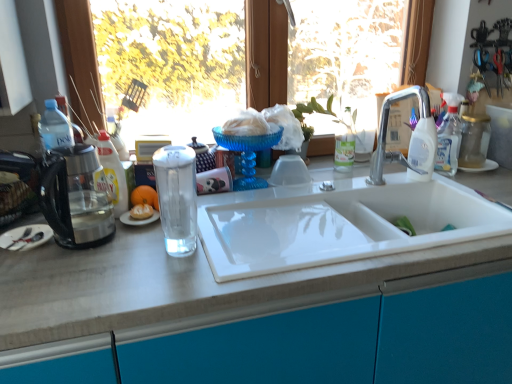
I want to click on vacant space situated above white matte countertop at center (from a real-world perspective), so click(x=262, y=216).